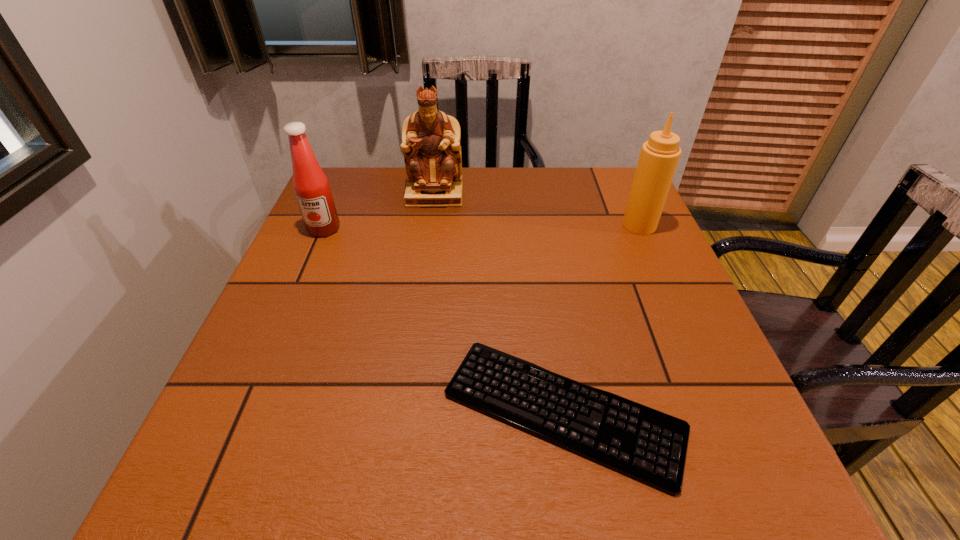
Locate an element on the screen. Image resolution: width=960 pixels, height=540 pixels. free spot between the leftmost object and the farthest object is located at coordinates (379, 212).

Image resolution: width=960 pixels, height=540 pixels. I want to click on object that ranks as the second closest to the leftmost object, so click(x=645, y=444).

Where is `the second closest object to the farthest object`? Image resolution: width=960 pixels, height=540 pixels. the second closest object to the farthest object is located at coordinates (659, 156).

Image resolution: width=960 pixels, height=540 pixels. In order to click on vacant point that satisfies the following two spatial constraints: 1. on the front-facing side of the right condiment; 2. on the right side of the farthest object in this screenshot , I will do `click(431, 225)`.

This screenshot has height=540, width=960. Find the location of `vacant space that satisfies the following two spatial constraints: 1. on the front-facing side of the shortest object; 2. on the left side of the leftmost object`. vacant space that satisfies the following two spatial constraints: 1. on the front-facing side of the shortest object; 2. on the left side of the leftmost object is located at coordinates (246, 411).

The height and width of the screenshot is (540, 960). I want to click on free space that satisfies the following two spatial constraints: 1. on the front-facing side of the figurine; 2. on the left side of the computer keyboard, so click(405, 411).

In order to click on vacant area that satisfies the following two spatial constraints: 1. on the front-facing side of the farthest object; 2. on the left side of the computer keyboard in this screenshot , I will do `click(405, 411)`.

The image size is (960, 540). What are the coordinates of `free space in the image that satisfies the following two spatial constraints: 1. on the front-facing side of the farthest object; 2. on the right side of the nearest object` in the screenshot? It's located at click(x=405, y=411).